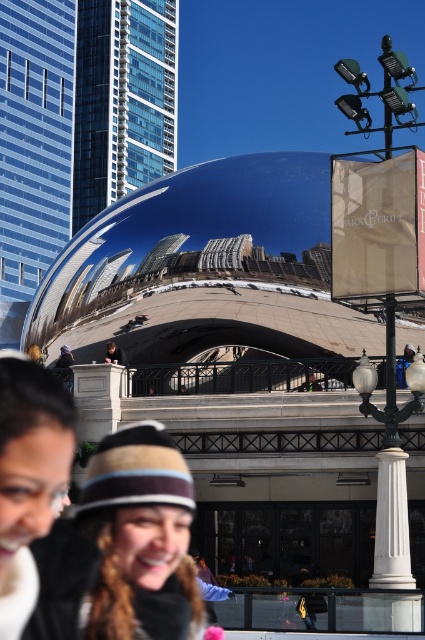
Which is in front, point (187, 604) or point (23, 552)?

Point (23, 552)

Can you confirm if striped knit hat at center is thinner than matte black hat at lower center?

No, striped knit hat at center is not thinner than matte black hat at lower center.

In order to click on striped knit hat at center in this screenshot , I will do `click(119, 547)`.